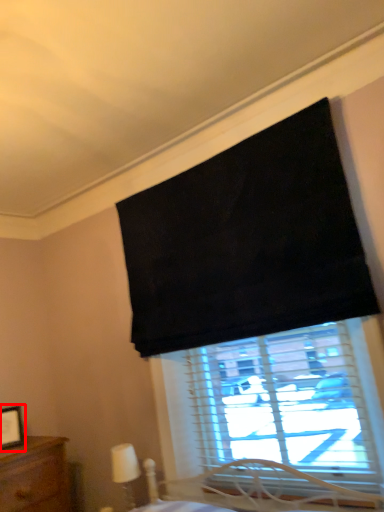
Question: Observing the image, what is the correct spatial positioning of picture frame (annotated by the red box) in reference to table lamp?

Choices:
 (A) right
 (B) left

Answer: (B)